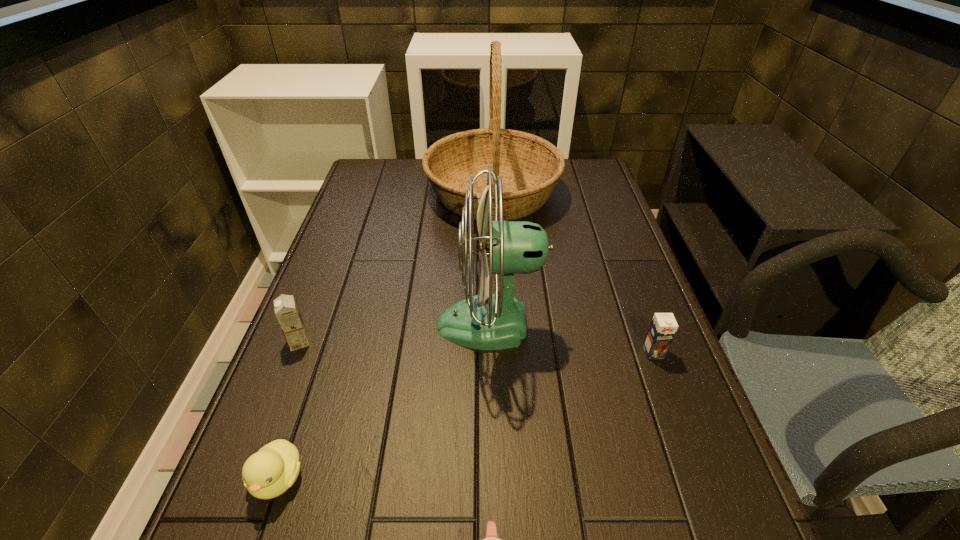
In the image, there is a desktop. What are the coordinates of `vacant space at the far left corner` in the screenshot? It's located at (395, 186).

At what (x,y) coordinates should I click in order to perform the action: click on empty space between the shorter chocolate milk and the fan. Please return your answer as a coordinate pair (x, y). The width and height of the screenshot is (960, 540). Looking at the image, I should click on click(x=572, y=339).

Where is `free area in between the basket and the left chocolate milk`? The width and height of the screenshot is (960, 540). free area in between the basket and the left chocolate milk is located at coordinates (396, 268).

Find the location of a particular element. The width and height of the screenshot is (960, 540). free point between the basket and the duckling is located at coordinates (385, 335).

This screenshot has width=960, height=540. Find the location of `free space between the duckling and the rightmost object`. free space between the duckling and the rightmost object is located at coordinates (466, 415).

Locate an element on the screen. free space between the second tallest object and the rightmost object is located at coordinates pyautogui.click(x=572, y=339).

Locate an element on the screen. Image resolution: width=960 pixels, height=540 pixels. the third closest object to the second tallest object is located at coordinates (268, 473).

Point out which object is positioned as the fifth nearest to the fan. Please provide its 2D coordinates. Your answer should be formatted as a tuple, i.e. [(x, y)], where the tuple contains the x and y coordinates of a point satisfying the conditions above.

[(491, 539)]

In order to click on vacant region that satisfies the following two spatial constraints: 1. on the back side of the basket; 2. on the right side of the left chocolate milk in this screenshot , I will do `click(357, 193)`.

The width and height of the screenshot is (960, 540). What are the coordinates of `free spot that satisfies the following two spatial constraints: 1. on the back side of the left chocolate milk; 2. on the right side of the basket` in the screenshot? It's located at (357, 193).